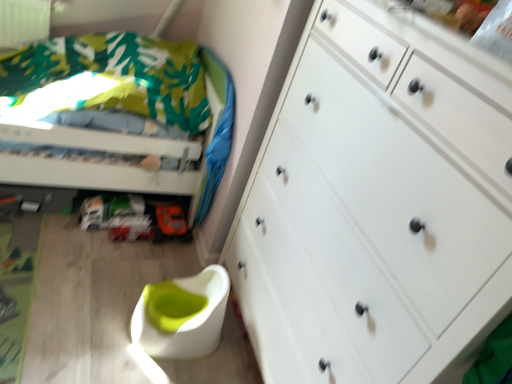
Question: Which is correct: white matte chest of drawers at right is inside green fabric bed at upper left, or outside of it?

Choices:
 (A) inside
 (B) outside

Answer: (B)

Question: Is white matte chest of drawers at right in front of or behind green fabric bed at upper left in the image?

Choices:
 (A) front
 (B) behind

Answer: (A)

Question: Which object is the farthest from the white plastic swivel chair at lower center?

Choices:
 (A) white matte chest of drawers at right
 (B) green fabric bed at upper left
 (C) orange matte toy car at lower center

Answer: (B)

Question: Which is nearer to the orange matte toy car at lower center?

Choices:
 (A) white plastic swivel chair at lower center
 (B) white matte chest of drawers at right
 (C) green fabric bed at upper left

Answer: (A)